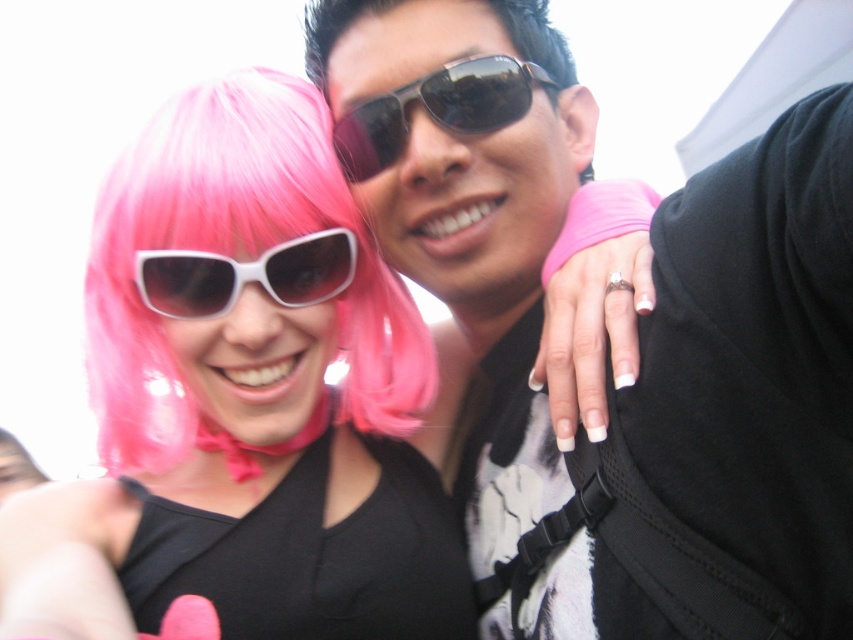
You are a photographer adjusting the lighting for a photo shoot. You notice the matte pink wig at center is casting a shadow. Which direction should you move the light source to shorten the shadow?

To shorten the shadow cast by the matte pink wig at center, move the light source closer to the matte pink wig at center.

You are a photographer trying to capture a closeup shot of both the matte pink wig at center and the sunglasses at center in the image. Given that your camera can focus on objects within a 12 inch range, will you be able to get both in focus at the same time?

The matte pink wig at center is 13.69 inches away from the sunglasses at center, which exceeds the camera focus range of 12 inches. Therefore, both cannot be in focus simultaneously.

You are a photographer trying to adjust the lighting for a photo shoot. You notice the matte black sunglasses at upper center and the black matte dress at center. Which object is located to the right of the other?

The matte black sunglasses at upper center is positioned on the right side of black matte dress at center.